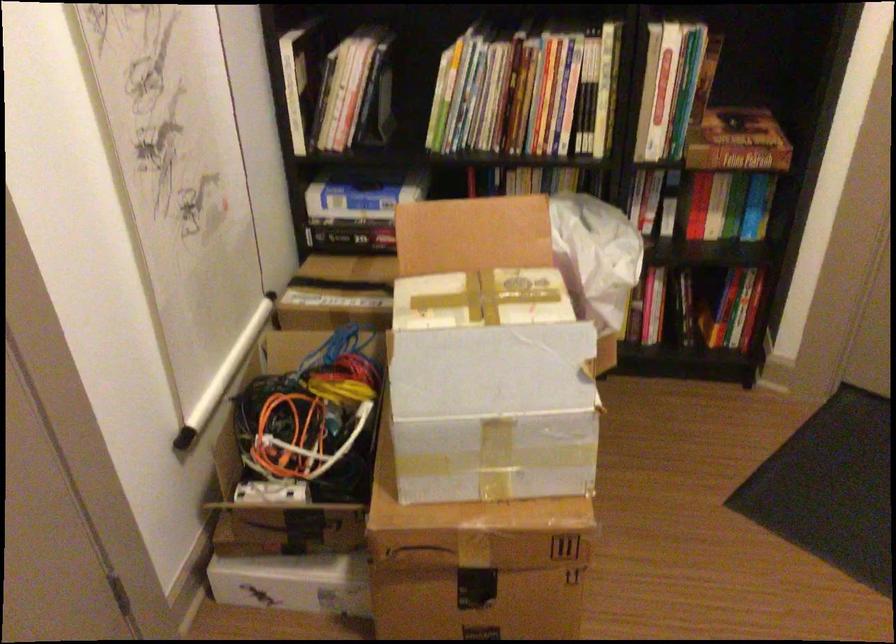
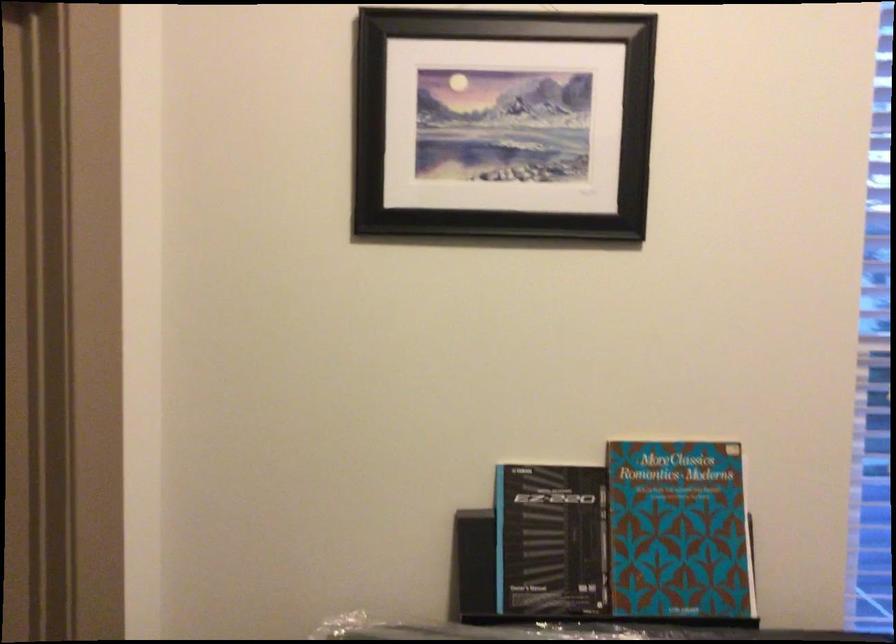
Question: The images are taken continuously from a first-person perspective. In which direction is your viewpoint rotating?

Choices:
 (A) Left
 (B) Right
 (C) Up
 (D) Down

Answer: (B)